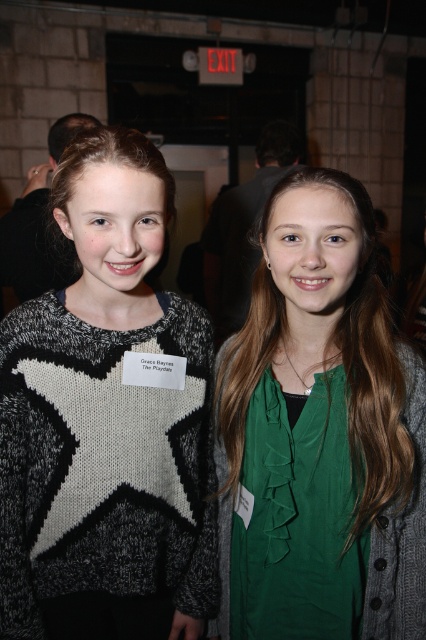
Does knit sweater with star at center appear under green fabric shirt at center?

Actually, knit sweater with star at center is above green fabric shirt at center.

Is point (129, 228) positioned in front of point (327, 464)?

Yes, it is.

At what (x,y) coordinates should I click in order to perform the action: click on knit sweater with star at center. Please return your answer as a coordinate pair (x, y). The image size is (426, 640). Looking at the image, I should click on (106, 422).